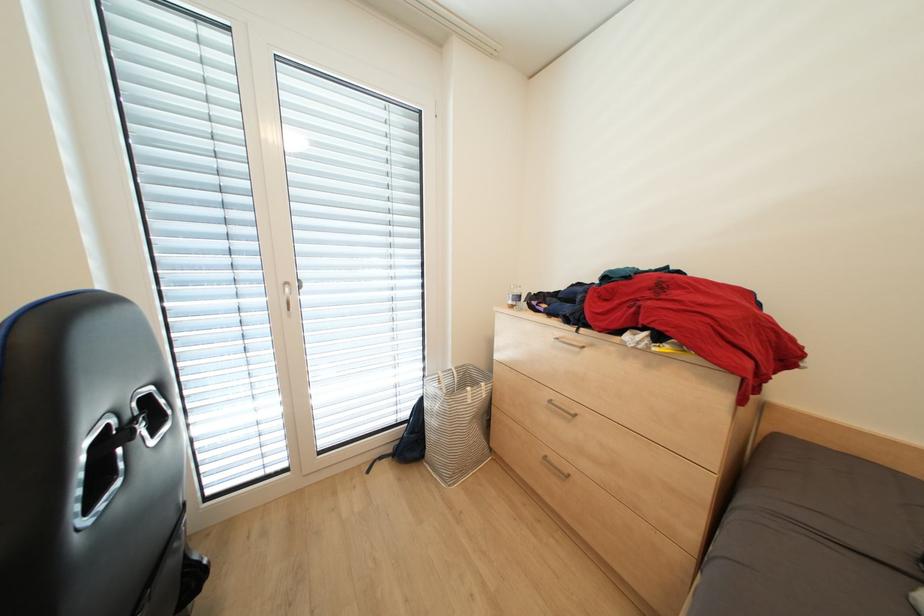
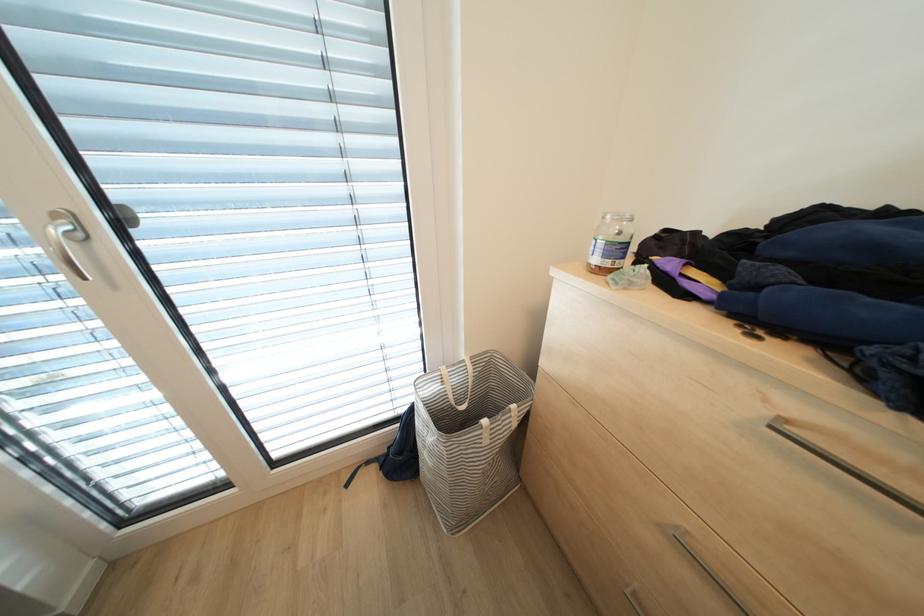
Question: Which direction would the cameraman need to move to produce the second image? Reply with the corresponding letter.

Choices:
 (A) Left
 (B) Right
 (C) Forward
 (D) Backward

Answer: (C)